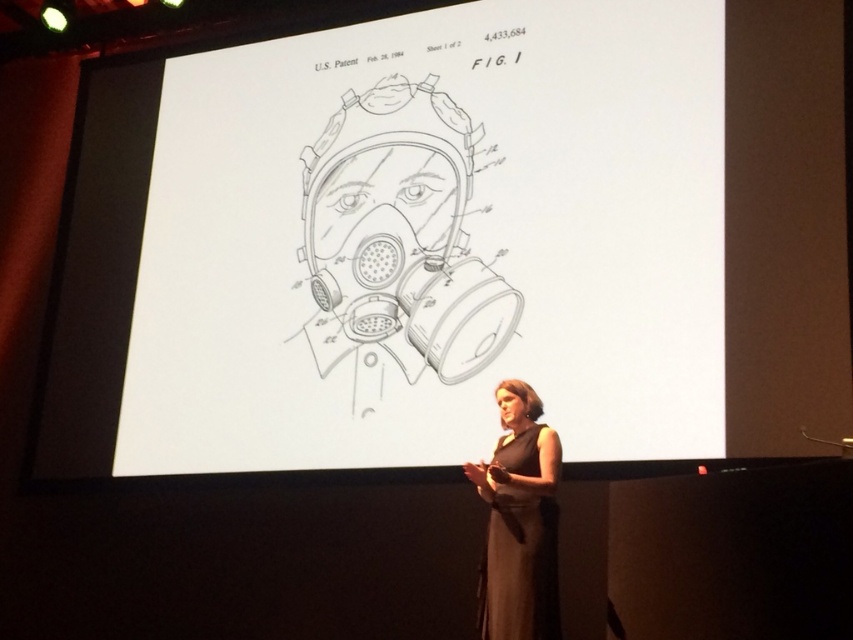
You are an attendee at a patent presentation. You notice the white paper at center and the dark gray dress at center. Which object is positioned to the right side of the other?

The white paper at center is to the left of dark gray dress at center, so the dark gray dress at center is positioned to the right side of the white paper at center.

You are an event planner setting up for a presentation. You need to place a 3.5 feet wide table between the white paper at center and the dark gray dress at center. Will there be enough space between them to fit the table?

The white paper at center and dark gray dress at center are 5.41 feet apart. Since the table is 3.5 feet wide, there is enough space between them to fit the table as 5.41 feet is greater than 3.5 feet.